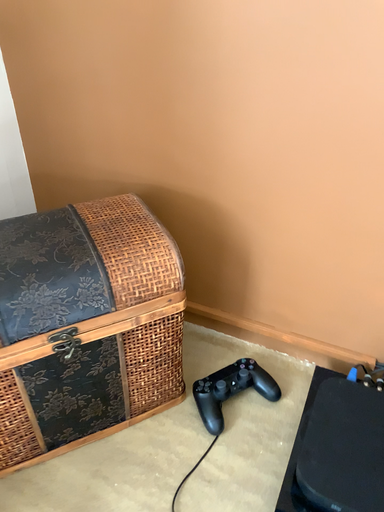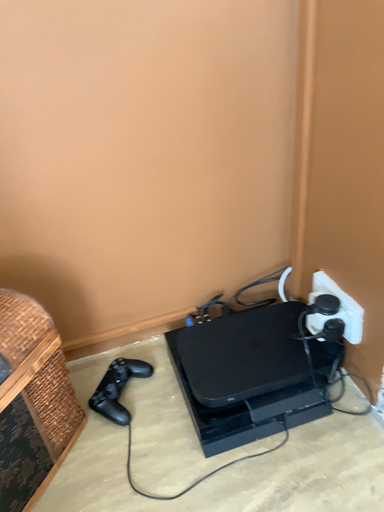
Question: How did the camera likely rotate when shooting the video?

Choices:
 (A) rotated right
 (B) rotated left

Answer: (A)